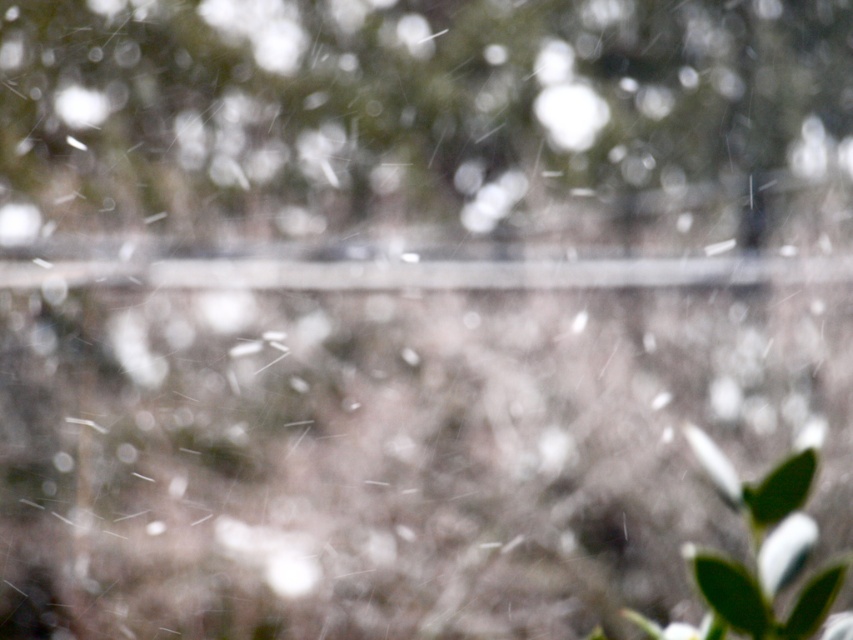
Question: Does green leafy tree at center have a greater width compared to green matte leaf at lower right?

Choices:
 (A) no
 (B) yes

Answer: (B)

Question: Which point is closer to the camera?

Choices:
 (A) green matte leaf at lower right
 (B) green leafy tree at center

Answer: (A)

Question: Does green leafy tree at center appear over green matte leaf at lower right?

Choices:
 (A) no
 (B) yes

Answer: (B)

Question: Is green leafy tree at center to the left of green matte leaf at lower right from the viewer's perspective?

Choices:
 (A) yes
 (B) no

Answer: (A)

Question: Which point is farther to the camera?

Choices:
 (A) green leafy tree at center
 (B) green matte leaf at lower right

Answer: (A)